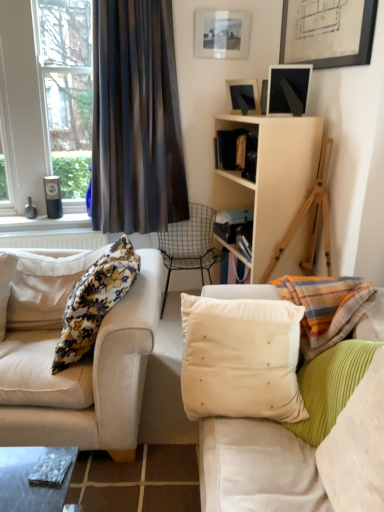
Locate an element on the screen. The image size is (384, 512). free spot above matte black picture frame at upper right, marked as the 3th picture frame in a top-to-bottom arrangement (from a real-world perspective) is located at coordinates (286, 67).